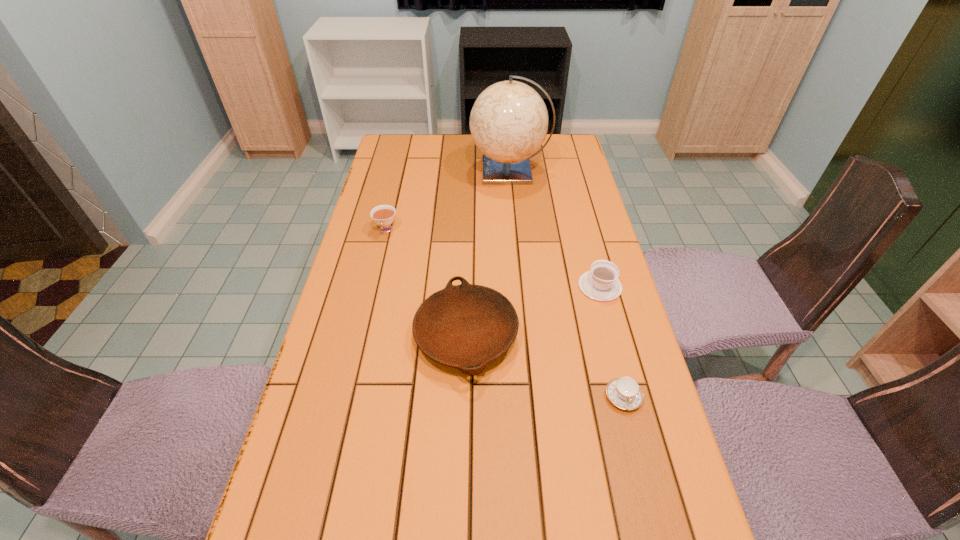
The width and height of the screenshot is (960, 540). Identify the location of blank space located 0.140m on the surface of the farthest object showing Europe and Africa. (432, 171).

Where is `vacant space positioned on the left of the plate`? The width and height of the screenshot is (960, 540). vacant space positioned on the left of the plate is located at coordinates (395, 335).

Where is `blank area located 0.160m on the side of the leftmost teacup with the handle`? This screenshot has width=960, height=540. blank area located 0.160m on the side of the leftmost teacup with the handle is located at coordinates (375, 276).

Where is `vacant space located 0.370m on the handle side of the second farthest teacup`? Image resolution: width=960 pixels, height=540 pixels. vacant space located 0.370m on the handle side of the second farthest teacup is located at coordinates (576, 196).

You are a GUI agent. You are given a task and a screenshot of the screen. Output one action in this format:
    pyautogui.click(x=<x>, y=<y>)
    Task: Click on the vacant space situated 0.070m on the handle side of the second farthest teacup
    
    Given the screenshot: What is the action you would take?
    pyautogui.click(x=591, y=255)

This screenshot has height=540, width=960. Find the location of `free space located on the handle side of the second farthest teacup`. free space located on the handle side of the second farthest teacup is located at coordinates (580, 210).

What are the coordinates of `free region located on the side with the handle of the shortest teacup` in the screenshot? It's located at (637, 450).

Locate an element on the screen. This screenshot has height=540, width=960. object that is positioned at the far edge is located at coordinates (509, 120).

Identify the location of object located in the left edge section of the desktop. (383, 215).

The height and width of the screenshot is (540, 960). I want to click on globe that is positioned at the right edge, so click(509, 120).